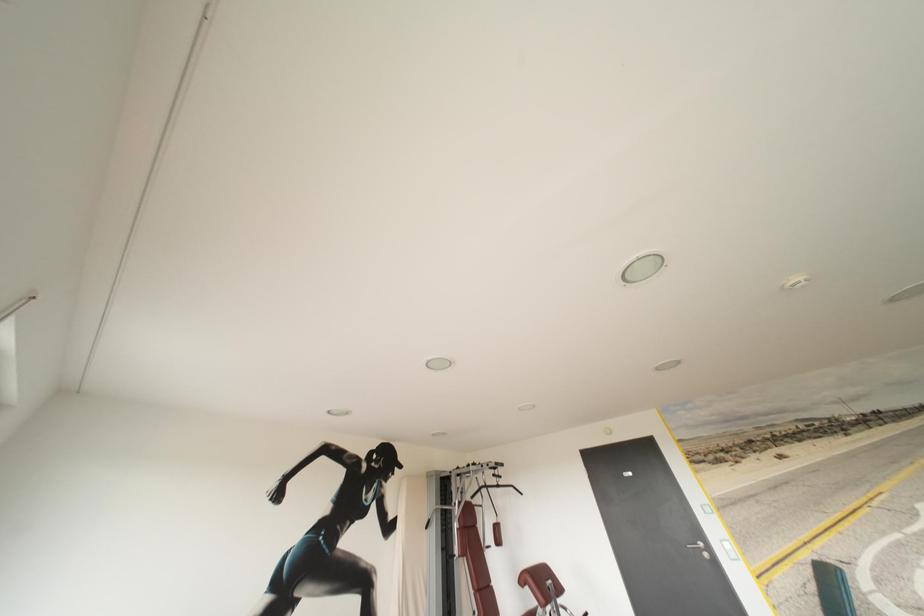
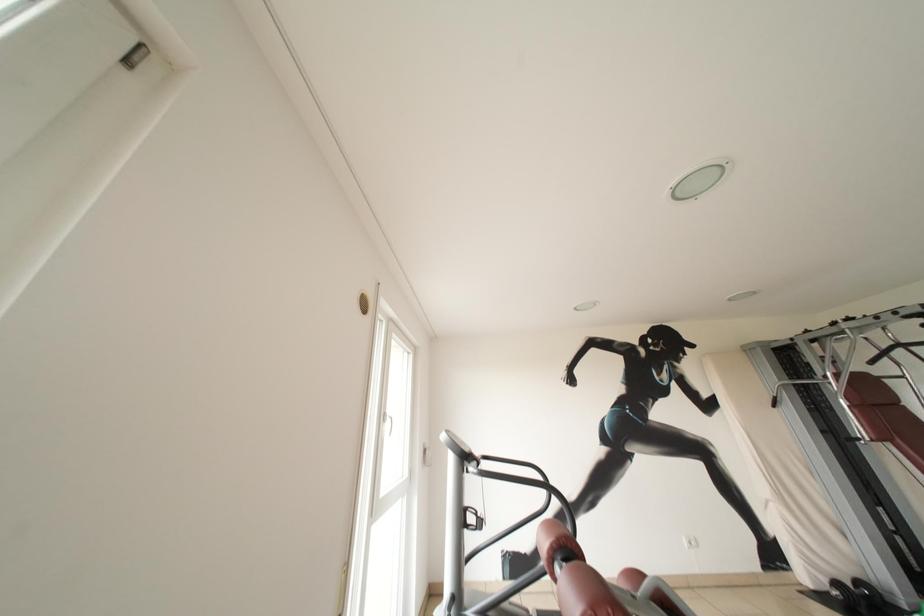
Question: The camera is either moving clockwise (left) or counter-clockwise (right) around the object. The first image is from the beginning of the video and the second image is from the end. Is the camera moving left or right when shooting the video?

Choices:
 (A) Left
 (B) Right

Answer: (B)